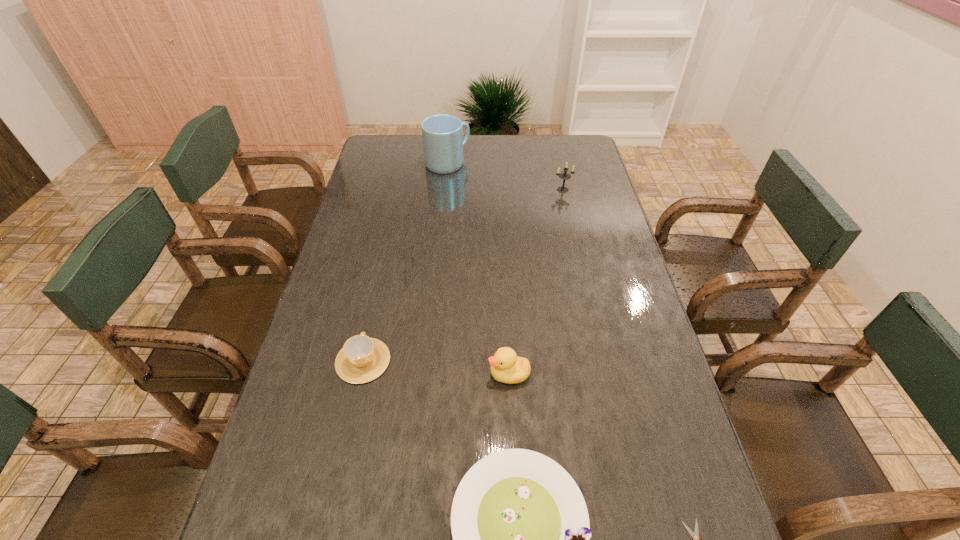
In the image, there is a desktop. Where is `vacant space at the right edge`? This screenshot has width=960, height=540. vacant space at the right edge is located at coordinates (630, 488).

Locate an element on the screen. This screenshot has height=540, width=960. free location at the far left corner of the desktop is located at coordinates click(392, 141).

The image size is (960, 540). In the image, there is a desktop. In order to click on free region at the far right corner in this screenshot , I will do `click(585, 141)`.

Identify the location of free space between the second tallest object and the tallest object. 505,177.

Find the location of `free spot between the tallest object and the fifth object from left to right`. free spot between the tallest object and the fifth object from left to right is located at coordinates (505, 177).

You are a GUI agent. You are given a task and a screenshot of the screen. Output one action in this format:
    pyautogui.click(x=<x>, y=<y>)
    Task: Click on the free spot between the mug and the fifth shortest object
    The height and width of the screenshot is (540, 960).
    Given the screenshot: What is the action you would take?
    pyautogui.click(x=505, y=177)

Where is `free space that is in between the tallest object and the third shortest object`? Image resolution: width=960 pixels, height=540 pixels. free space that is in between the tallest object and the third shortest object is located at coordinates 405,262.

Identify the location of empty space between the second farthest object and the duck. (536, 282).

What are the coordinates of `object that stands as the closest to the duck` in the screenshot? It's located at (520, 526).

Select which object appears as the closest to the duck. Please provide its 2D coordinates. Your answer should be formatted as a tuple, i.e. [(x, y)], where the tuple contains the x and y coordinates of a point satisfying the conditions above.

[(520, 526)]